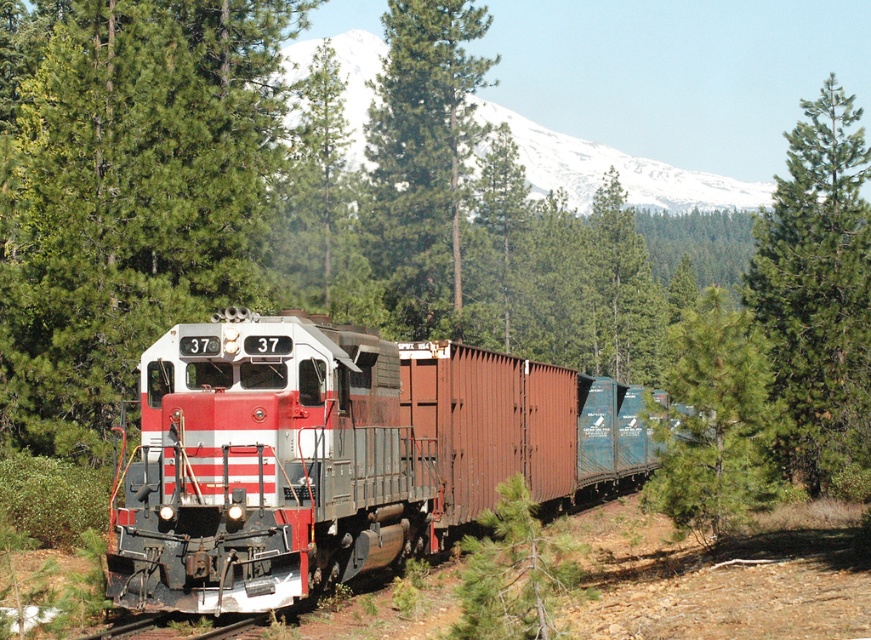
Does point (369, 99) lie in front of point (241, 624)?

No.

Can you confirm if snowy mountain at upper center is positioned above metal at bottom?

Indeed, snowy mountain at upper center is positioned over metal at bottom.

Between point (288, 51) and point (218, 628), which one is positioned in front?

Point (218, 628) is more forward.

Locate an element on the screen. snowy mountain at upper center is located at coordinates 616,170.

Is green matte tree at center closer to the viewer compared to snowy mountain at upper center?

Yes, it is in front of snowy mountain at upper center.

Between green matte tree at center and snowy mountain at upper center, which one is positioned higher?

snowy mountain at upper center

I want to click on green matte tree at center, so click(422, 160).

Based on the photo, is matte red train at center taller than metal at bottom?

Yes.

Can you confirm if matte red train at center is positioned above metal at bottom?

Yes, matte red train at center is above metal at bottom.

Is point (616, 461) closer to viewer compared to point (112, 627)?

No, it is not.

The width and height of the screenshot is (871, 640). What are the coordinates of `matte red train at center` in the screenshot? It's located at (338, 454).